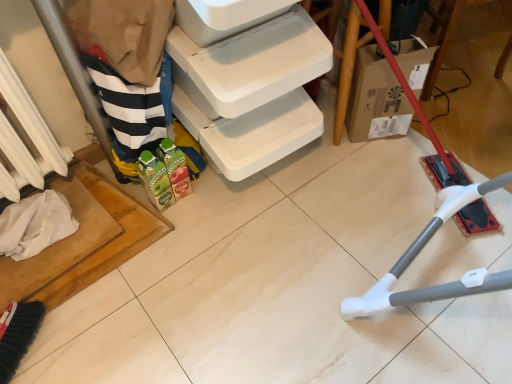
Question: Should I look upward or downward to see white painted metal radiator at left?

Choices:
 (A) down
 (B) up

Answer: (B)

Question: From a real-world perspective, is white plastic shelf at lower left physically below cardboard box at lower right?

Choices:
 (A) no
 (B) yes

Answer: (A)

Question: Is white plastic shelf at lower left to the left of cardboard box at lower right from the viewer's perspective?

Choices:
 (A) yes
 (B) no

Answer: (A)

Question: Considering the relative sizes of white plastic shelf at lower left and cardboard box at lower right in the image provided, is white plastic shelf at lower left taller than cardboard box at lower right?

Choices:
 (A) no
 (B) yes

Answer: (B)

Question: Is the position of white plastic shelf at lower left more distant than that of cardboard box at lower right?

Choices:
 (A) no
 (B) yes

Answer: (A)

Question: Is white plastic shelf at lower left oriented away from cardboard box at lower right?

Choices:
 (A) no
 (B) yes

Answer: (A)

Question: Does white plastic shelf at lower left turn towards cardboard box at lower right?

Choices:
 (A) yes
 (B) no

Answer: (B)

Question: Is cardboard box at lower right positioned with its back to white painted metal radiator at left?

Choices:
 (A) yes
 (B) no

Answer: (B)

Question: Considering the relative sizes of cardboard box at lower right and white painted metal radiator at left in the image provided, is cardboard box at lower right smaller than white painted metal radiator at left?

Choices:
 (A) no
 (B) yes

Answer: (A)

Question: Is cardboard box at lower right oriented towards white painted metal radiator at left?

Choices:
 (A) no
 (B) yes

Answer: (A)

Question: Considering the relative positions of cardboard box at lower right and white painted metal radiator at left in the image provided, is cardboard box at lower right to the right of white painted metal radiator at left from the viewer's perspective?

Choices:
 (A) no
 (B) yes

Answer: (B)

Question: Is cardboard box at lower right to the left of white painted metal radiator at left from the viewer's perspective?

Choices:
 (A) no
 (B) yes

Answer: (A)

Question: Can you confirm if cardboard box at lower right is thinner than white painted metal radiator at left?

Choices:
 (A) yes
 (B) no

Answer: (B)

Question: Could you tell me if cardboard box at lower right is facing white plastic shelf at lower left?

Choices:
 (A) yes
 (B) no

Answer: (B)